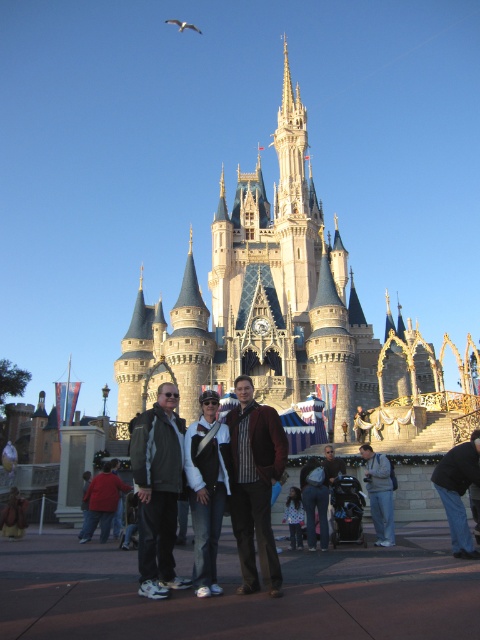
Question: Is dark gray jacket at center positioned at the back of red jacket at lower left?

Choices:
 (A) yes
 (B) no

Answer: (B)

Question: Observing the image, what is the correct spatial positioning of blue stone castle at center in reference to denim jacket at center?

Choices:
 (A) below
 (B) above

Answer: (B)

Question: Is brown leather jacket at center bigger than denim jacket at center?

Choices:
 (A) yes
 (B) no

Answer: (A)

Question: Which point is closer to the camera?

Choices:
 (A) brown leather jacket at center
 (B) denim jacket at center

Answer: (A)

Question: Which of the following is the closest to the observer?

Choices:
 (A) blue stone castle at center
 (B) brown leather jacket at center
 (C) red jacket at lower left
 (D) jeans at center

Answer: (B)

Question: Which object appears farthest from the camera in this image?

Choices:
 (A) dark gray jacket at center
 (B) brown leather jacket at center
 (C) jeans at center

Answer: (C)